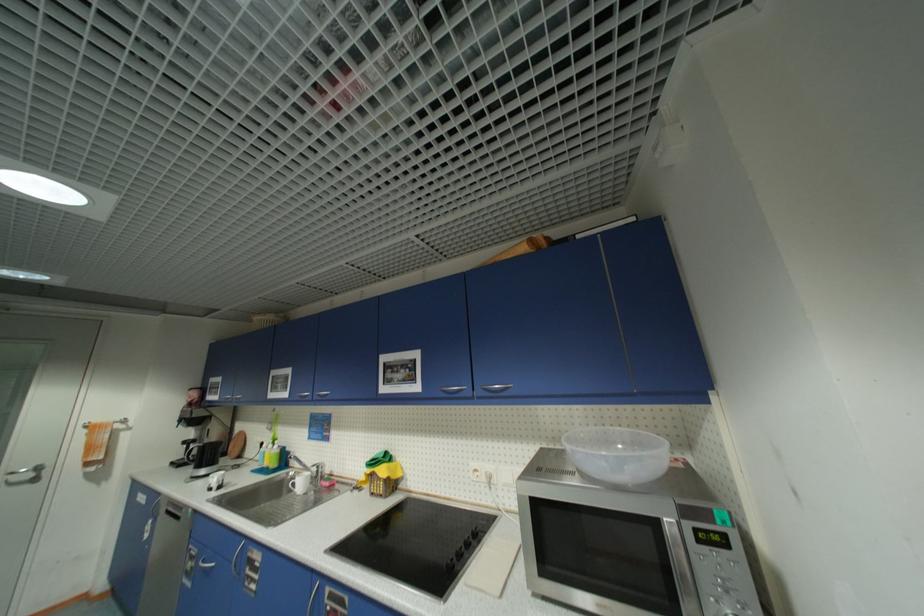
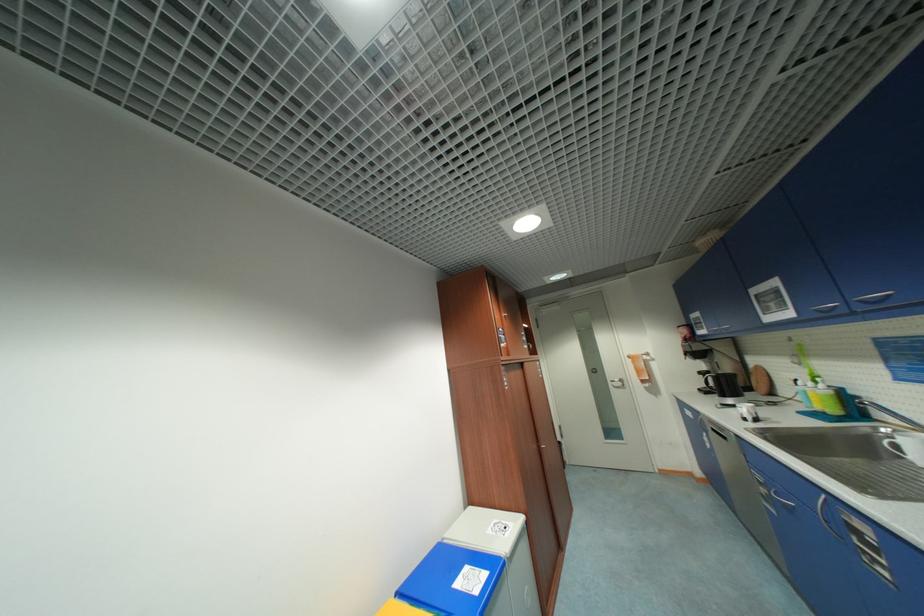
Locate, in the second image, the point that corresponds to point 323,395 in the first image.

(867, 302)